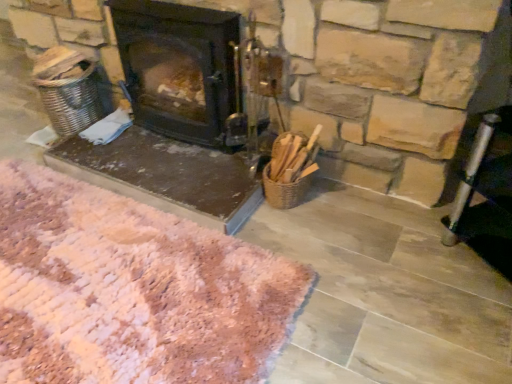
Question: Can you confirm if black matte wood burning stove at center is shorter than pink shaggy rug at lower left?

Choices:
 (A) no
 (B) yes

Answer: (A)

Question: From the image's perspective, is black matte wood burning stove at center under pink shaggy rug at lower left?

Choices:
 (A) no
 (B) yes

Answer: (A)

Question: Considering the relative sizes of black matte wood burning stove at center and pink shaggy rug at lower left in the image provided, is black matte wood burning stove at center taller than pink shaggy rug at lower left?

Choices:
 (A) no
 (B) yes

Answer: (B)

Question: Is black matte wood burning stove at center further to the viewer compared to pink shaggy rug at lower left?

Choices:
 (A) yes
 (B) no

Answer: (A)

Question: Would you consider black matte wood burning stove at center to be distant from pink shaggy rug at lower left?

Choices:
 (A) no
 (B) yes

Answer: (A)

Question: Is black matte wood burning stove at center to the left of pink shaggy rug at lower left from the viewer's perspective?

Choices:
 (A) no
 (B) yes

Answer: (A)

Question: Is the surface of pink shaggy rug at lower left in direct contact with black matte wood burning stove at center?

Choices:
 (A) yes
 (B) no

Answer: (B)

Question: From the image's perspective, does pink shaggy rug at lower left appear lower than black matte wood burning stove at center?

Choices:
 (A) no
 (B) yes

Answer: (B)

Question: Does pink shaggy rug at lower left come in front of black matte wood burning stove at center?

Choices:
 (A) no
 (B) yes

Answer: (B)

Question: From a real-world perspective, is pink shaggy rug at lower left on top of black matte wood burning stove at center?

Choices:
 (A) yes
 (B) no

Answer: (B)

Question: Is pink shaggy rug at lower left at the right side of black matte wood burning stove at center?

Choices:
 (A) no
 (B) yes

Answer: (A)

Question: Does pink shaggy rug at lower left contain black matte wood burning stove at center?

Choices:
 (A) yes
 (B) no

Answer: (B)

Question: Relative to black matte wood burning stove at center, is pink shaggy rug at lower left in front or behind?

Choices:
 (A) front
 (B) behind

Answer: (A)